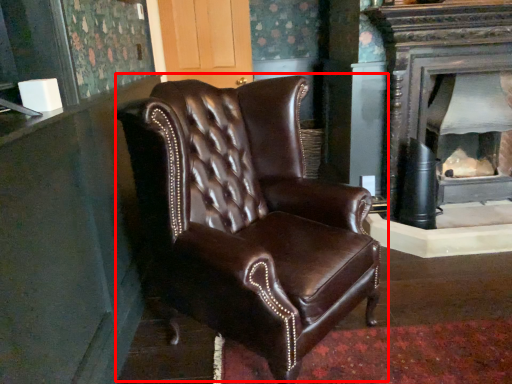
Question: From the image's perspective, what is the correct spatial positioning of chair (annotated by the red box) in reference to fireplace?

Choices:
 (A) above
 (B) below

Answer: (B)